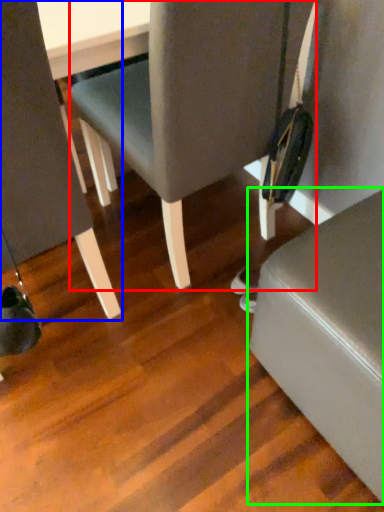
Question: Estimate the real-world distances between objects in this image. Which object is farther from chair (highlighted by a red box), chair (highlighted by a blue box) or furniture (highlighted by a green box)?

Choices:
 (A) chair
 (B) furniture

Answer: (B)